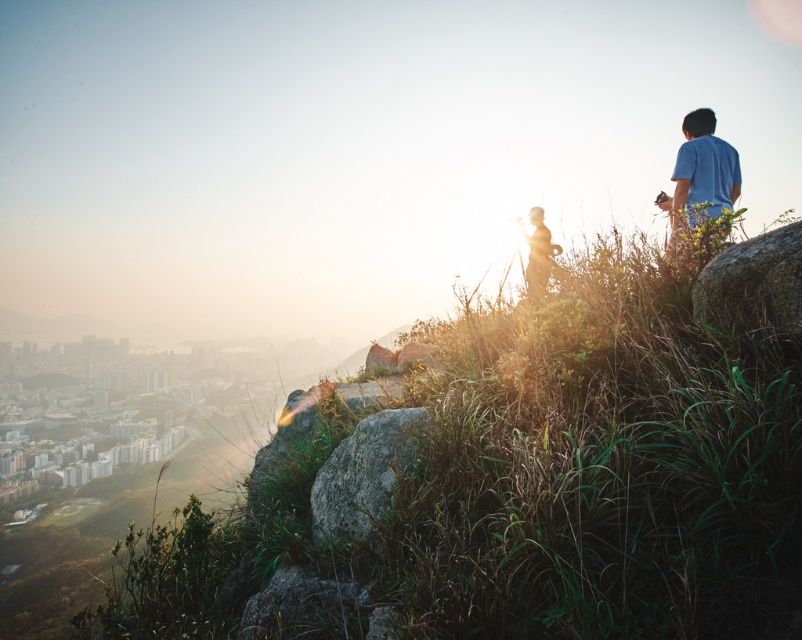
Question: Which object is closer to the camera taking this photo?

Choices:
 (A) silhouette figure at center
 (B) blue cotton shirt at right
 (C) smooth gray rock at right

Answer: (C)

Question: Which of the following is the closest to the observer?

Choices:
 (A) gray rough rock at center
 (B) silhouette figure at center
 (C) smooth gray rock at right
 (D) blue cotton shirt at right

Answer: (C)

Question: Considering the real-world distances, which object is closest to the blue cotton shirt at right?

Choices:
 (A) smooth gray rock at right
 (B) silhouette figure at center
 (C) gray rough rock at center

Answer: (A)

Question: Can you confirm if gray rough rock at center is positioned to the left of blue cotton shirt at right?

Choices:
 (A) no
 (B) yes

Answer: (B)

Question: Can you confirm if gray rough rock at center is smaller than blue cotton shirt at right?

Choices:
 (A) yes
 (B) no

Answer: (A)

Question: Can you confirm if gray rough rock at center is wider than blue cotton shirt at right?

Choices:
 (A) no
 (B) yes

Answer: (A)